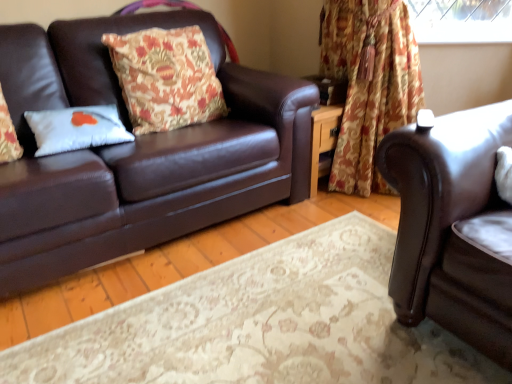
Question: Could you tell me if white matte pillow at left, the second pillow viewed from the right, is turned towards floral-patterned fabric pillow at left, the first pillow viewed from the right?

Choices:
 (A) yes
 (B) no

Answer: (B)

Question: Does white matte pillow at left, the second pillow viewed from the right, have a greater height compared to floral-patterned fabric pillow at left, the first pillow viewed from the right?

Choices:
 (A) yes
 (B) no

Answer: (B)

Question: Does white matte pillow at left, the second pillow viewed from the right, have a lesser width compared to floral-patterned fabric pillow at left, placed as the 2th pillow when sorted from left to right?

Choices:
 (A) no
 (B) yes

Answer: (B)

Question: Is white matte pillow at left, the 1th pillow from the left, outside floral-patterned fabric pillow at left, placed as the 2th pillow when sorted from left to right?

Choices:
 (A) no
 (B) yes

Answer: (B)

Question: Is white matte pillow at left, the 1th pillow from the left, at the right side of floral-patterned fabric pillow at left, placed as the 2th pillow when sorted from left to right?

Choices:
 (A) no
 (B) yes

Answer: (A)

Question: Considering the positions of brown leather couch at right, which is the first studio couch from right to left, and white matte pillow at left, the second pillow viewed from the right, in the image, is brown leather couch at right, which is the first studio couch from right to left, wider or thinner than white matte pillow at left, the second pillow viewed from the right,?

Choices:
 (A) thin
 (B) wide

Answer: (B)

Question: From the image's perspective, is brown leather couch at right, the second studio couch positioned from the left, positioned above or below white matte pillow at left, the second pillow viewed from the right?

Choices:
 (A) below
 (B) above

Answer: (A)

Question: Is brown leather couch at right, which is the first studio couch from right to left, taller or shorter than white matte pillow at left, the second pillow viewed from the right?

Choices:
 (A) short
 (B) tall

Answer: (B)

Question: Relative to white matte pillow at left, the 1th pillow from the left, is brown leather couch at right, the second studio couch positioned from the left, in front or behind?

Choices:
 (A) behind
 (B) front

Answer: (B)

Question: Considering the positions of point (70, 107) and point (143, 107), is point (70, 107) closer or farther from the camera than point (143, 107)?

Choices:
 (A) farther
 (B) closer

Answer: (B)

Question: From a real-world perspective, is white matte pillow at left, the second pillow viewed from the right, above or below floral-patterned fabric pillow at left, the first pillow viewed from the right?

Choices:
 (A) below
 (B) above

Answer: (A)

Question: Is white matte pillow at left, the 1th pillow from the left, wider or thinner than floral-patterned fabric pillow at left, the first pillow viewed from the right?

Choices:
 (A) wide
 (B) thin

Answer: (B)

Question: Which is correct: white matte pillow at left, the second pillow viewed from the right, is inside floral-patterned fabric pillow at left, the first pillow viewed from the right, or outside of it?

Choices:
 (A) inside
 (B) outside

Answer: (B)

Question: Looking at their shapes, would you say matte brown leather couch at left, which is the second studio couch in right-to-left order, is wider or thinner than floral fabric curtain at upper right?

Choices:
 (A) thin
 (B) wide

Answer: (B)

Question: Based on their positions, is matte brown leather couch at left, which is the second studio couch in right-to-left order, located to the left or right of floral fabric curtain at upper right?

Choices:
 (A) left
 (B) right

Answer: (A)